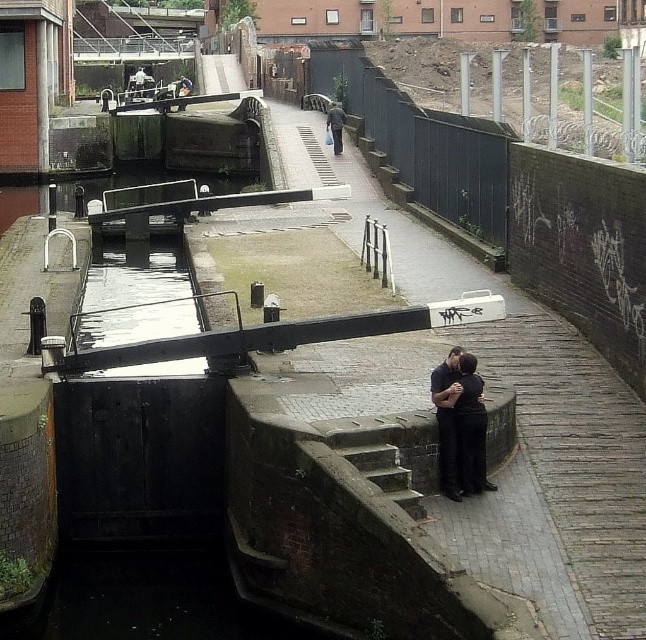
Question: Does black smooth couple at center have a larger size compared to dark gray concrete man at center?

Choices:
 (A) no
 (B) yes

Answer: (B)

Question: Where is dark gray concrete man at center located in relation to smooth leather jacket at upper center in the image?

Choices:
 (A) left
 (B) right

Answer: (B)

Question: Which point is farther from the camera taking this photo?

Choices:
 (A) (145, 76)
 (B) (335, 132)

Answer: (A)

Question: Does black smooth couple at center come behind dark gray concrete man at center?

Choices:
 (A) no
 (B) yes

Answer: (A)

Question: Which point is closer to the camera?

Choices:
 (A) (450, 442)
 (B) (138, 93)
 (C) (335, 124)

Answer: (A)

Question: Which point is farther to the camera?

Choices:
 (A) smooth leather jacket at upper center
 (B) dark gray concrete man at center

Answer: (A)